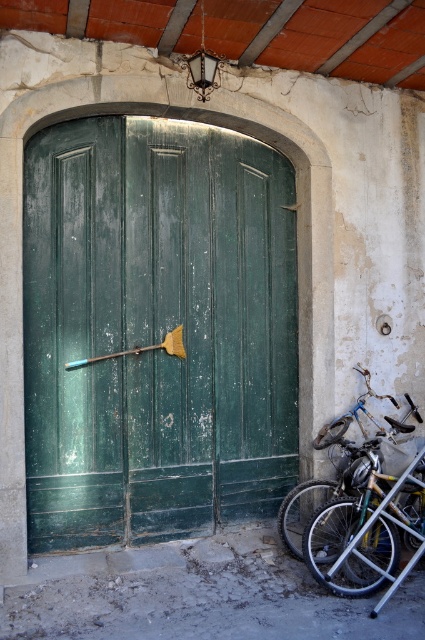
Consider the image. Between green wooden door at center and blue metallic bicycle at lower right, which one is positioned higher?

Positioned higher is green wooden door at center.

Is point (96, 368) closer to camera compared to point (413, 410)?

Yes, point (96, 368) is in front of point (413, 410).

Where is `green wooden door at center`? This screenshot has height=640, width=425. green wooden door at center is located at coordinates (155, 330).

Is shiny silver bicycle at lower right shorter than blue metallic bicycle at lower right?

In fact, shiny silver bicycle at lower right may be taller than blue metallic bicycle at lower right.

The width and height of the screenshot is (425, 640). What are the coordinates of `shiny silver bicycle at lower right` in the screenshot? It's located at (367, 531).

In order to click on shiny silver bicycle at lower right in this screenshot , I will do `click(367, 531)`.

Where is `shiny silver bicycle at lower right`? The image size is (425, 640). shiny silver bicycle at lower right is located at coordinates (367, 531).

Does green wooden door at center appear under shiny silver bicycle at lower right?

Incorrect, green wooden door at center is not positioned below shiny silver bicycle at lower right.

Is green wooden door at center positioned at the back of shiny silver bicycle at lower right?

Yes, it is.

Which is behind, point (164, 326) or point (345, 522)?

Point (164, 326)

Where is `green wooden door at center`? The height and width of the screenshot is (640, 425). green wooden door at center is located at coordinates (155, 330).